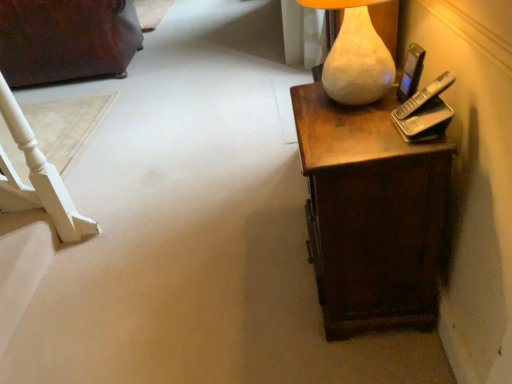
This screenshot has width=512, height=384. What do you see at coordinates (371, 214) in the screenshot?
I see `brown wood desk at right` at bounding box center [371, 214].

Where is `brown wood desk at right`? Image resolution: width=512 pixels, height=384 pixels. brown wood desk at right is located at coordinates (371, 214).

Describe the element at coordinates (66, 39) in the screenshot. The image size is (512, 384). I see `dark brown wood dresser at upper left` at that location.

Find the location of a particular element. The height and width of the screenshot is (384, 512). black plastic mobile phone at upper right is located at coordinates (411, 72).

Would you say black plastic mobile phone at upper right is to the left or to the right of brown wood desk at right in the picture?

black plastic mobile phone at upper right is positioned on brown wood desk at right's right side.

How many degrees apart are the facing directions of black plastic mobile phone at upper right and brown wood desk at right?

4.85 degrees separate the facing orientations of black plastic mobile phone at upper right and brown wood desk at right.

Does black plastic mobile phone at upper right have a lesser height compared to brown wood desk at right?

Indeed, black plastic mobile phone at upper right has a lesser height compared to brown wood desk at right.

Between black plastic mobile phone at upper right and brown wood desk at right, which one has larger width?

brown wood desk at right is wider.

From a real-world perspective, which object stands above the other?

black plastic mobile phone at upper right is physically above.

Is the position of dark brown wood dresser at upper left less distant than that of black plastic mobile phone at upper right?

No, it is not.

Between dark brown wood dresser at upper left and black plastic mobile phone at upper right, which one has smaller size?

black plastic mobile phone at upper right.

Could you tell me if dark brown wood dresser at upper left is facing black plastic mobile phone at upper right?

No, dark brown wood dresser at upper left is not aimed at black plastic mobile phone at upper right.

Is brown wood desk at right oriented away from black plastic mobile phone at upper right?

No, brown wood desk at right is not facing the opposite direction of black plastic mobile phone at upper right.

Can you tell me how much brown wood desk at right and black plastic mobile phone at upper right differ in facing direction?

The facing directions of brown wood desk at right and black plastic mobile phone at upper right are 4.85 degrees apart.

Considering the relative sizes of brown wood desk at right and black plastic mobile phone at upper right in the image provided, is brown wood desk at right wider than black plastic mobile phone at upper right?

Yes, brown wood desk at right is wider than black plastic mobile phone at upper right.

Considering their positions, is brown wood desk at right located in front of or behind black plastic mobile phone at upper right?

brown wood desk at right is positioned closer to the viewer than black plastic mobile phone at upper right.

Which is closer, (414, 193) or (347, 104)?

Point (414, 193) is closer to the camera than point (347, 104).

Which of these two, brown wood desk at right or matte white lamp at upper right, stands taller?

brown wood desk at right.

Is brown wood desk at right bigger or smaller than matte white lamp at upper right?

Clearly, brown wood desk at right is larger in size than matte white lamp at upper right.

Is brown wood desk at right oriented towards matte white lamp at upper right?

No, brown wood desk at right is not oriented towards matte white lamp at upper right.

Does point (52, 50) come behind point (362, 4)?

Yes, point (52, 50) is farther from viewer.

Is dark brown wood dresser at upper left smaller than matte white lamp at upper right?

No, dark brown wood dresser at upper left is not smaller than matte white lamp at upper right.

From a real-world perspective, who is located higher, dark brown wood dresser at upper left or matte white lamp at upper right?

In real-world perspective, matte white lamp at upper right is above.

Looking at this image, could you tell me if dark brown wood dresser at upper left is turned towards matte white lamp at upper right?

No, dark brown wood dresser at upper left is not aimed at matte white lamp at upper right.

Does matte white lamp at upper right have a smaller size compared to brown wood desk at right?

Correct, matte white lamp at upper right occupies less space than brown wood desk at right.

Considering the sizes of matte white lamp at upper right and brown wood desk at right in the image, is matte white lamp at upper right wider or thinner than brown wood desk at right?

Clearly, matte white lamp at upper right has less width compared to brown wood desk at right.

Is matte white lamp at upper right positioned beyond the bounds of brown wood desk at right?

matte white lamp at upper right lies outside brown wood desk at right's area.

Is point (364, 69) behind point (405, 79)?

No, (364, 69) is closer to viewer.

From the image's perspective, relative to black plastic mobile phone at upper right, is matte white lamp at upper right above or below?

Based on their image positions, matte white lamp at upper right is located above black plastic mobile phone at upper right.

Which object is positioned more to the right, matte white lamp at upper right or black plastic mobile phone at upper right?

From the viewer's perspective, black plastic mobile phone at upper right appears more on the right side.

The width and height of the screenshot is (512, 384). What are the coordinates of `desk that appears below the black plastic mobile phone at upper right (from the image's perspective)` in the screenshot? It's located at (371, 214).

Where is `furniture on the left of black plastic mobile phone at upper right`? Image resolution: width=512 pixels, height=384 pixels. furniture on the left of black plastic mobile phone at upper right is located at coordinates (66, 39).

Based on their spatial positions, is matte white lamp at upper right or black plastic mobile phone at upper right further from brown wood desk at right?

black plastic mobile phone at upper right is further to brown wood desk at right.

Looking at the image, which one is located closer to black plastic mobile phone at upper right, matte white lamp at upper right or brown wood desk at right?

The object closer to black plastic mobile phone at upper right is matte white lamp at upper right.

Which object lies nearer to the anchor point matte white lamp at upper right, dark brown wood dresser at upper left or black plastic mobile phone at upper right?

black plastic mobile phone at upper right lies closer to matte white lamp at upper right than the other object.

Which object lies nearer to the anchor point dark brown wood dresser at upper left, black plastic mobile phone at upper right or matte white lamp at upper right?

matte white lamp at upper right is positioned closer to the anchor dark brown wood dresser at upper left.

Which object lies nearer to the anchor point black plastic mobile phone at upper right, brown wood desk at right or dark brown wood dresser at upper left?

Based on the image, brown wood desk at right appears to be nearer to black plastic mobile phone at upper right.

Considering their positions, is brown wood desk at right positioned further to matte white lamp at upper right than black plastic mobile phone at upper right?

brown wood desk at right is further to matte white lamp at upper right.

From the image, which object appears to be nearer to matte white lamp at upper right, black plastic mobile phone at upper right or dark brown wood dresser at upper left?

Among the two, black plastic mobile phone at upper right is located nearer to matte white lamp at upper right.

Considering their positions, is dark brown wood dresser at upper left positioned further to black plastic mobile phone at upper right than brown wood desk at right?

dark brown wood dresser at upper left is positioned further to the anchor black plastic mobile phone at upper right.

Locate an element on the screen. This screenshot has width=512, height=384. lamp between dark brown wood dresser at upper left and black plastic mobile phone at upper right is located at coordinates (355, 55).

In order to click on lamp between dark brown wood dresser at upper left and brown wood desk at right in this screenshot , I will do click(x=355, y=55).

Locate an element on the screen. This screenshot has width=512, height=384. desk between dark brown wood dresser at upper left and black plastic mobile phone at upper right is located at coordinates [x=371, y=214].

Find the location of a particular element. Image resolution: width=512 pixels, height=384 pixels. mobile phone that lies between matte white lamp at upper right and brown wood desk at right from top to bottom is located at coordinates (411, 72).